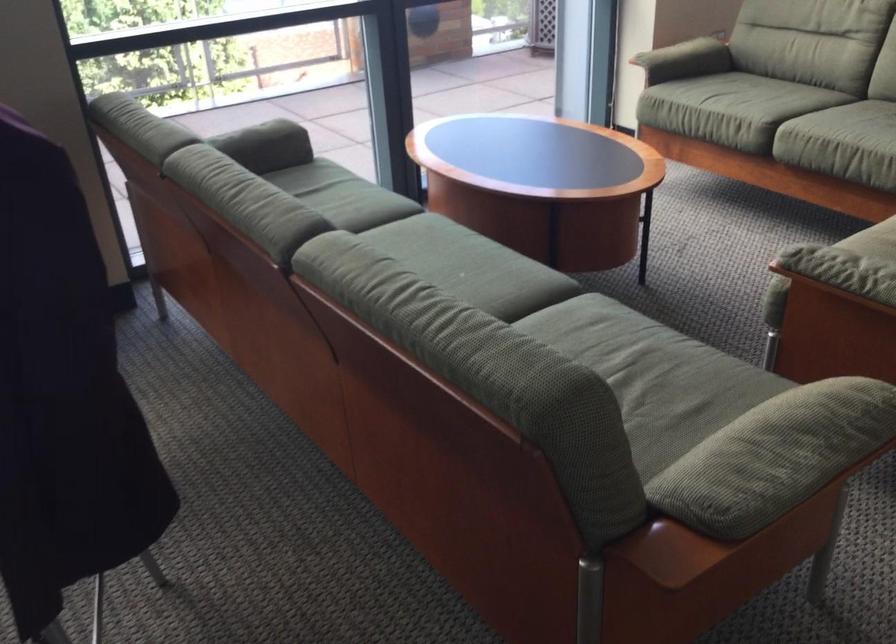
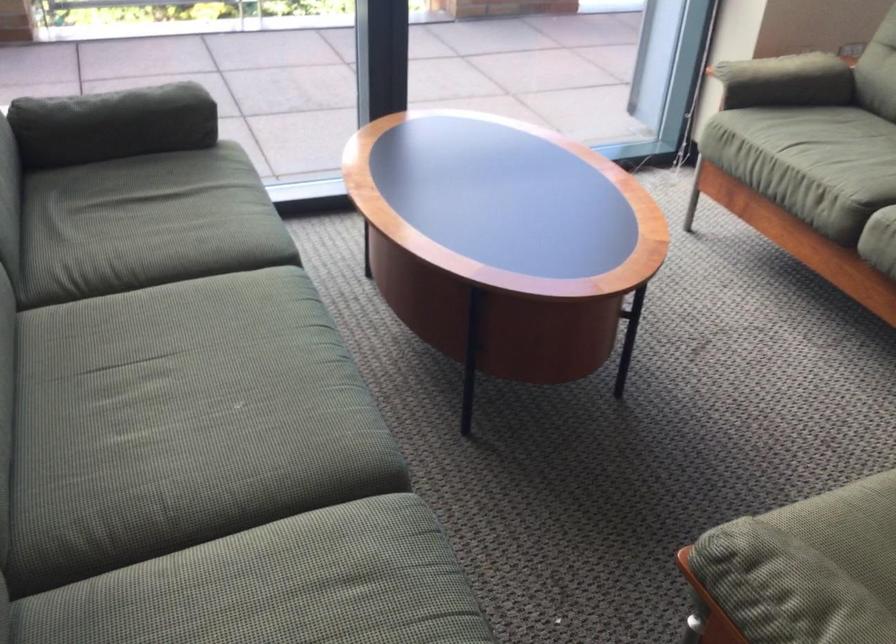
Question: How did the camera likely rotate?

Choices:
 (A) Left
 (B) Right
 (C) Up
 (D) Down

Answer: (A)